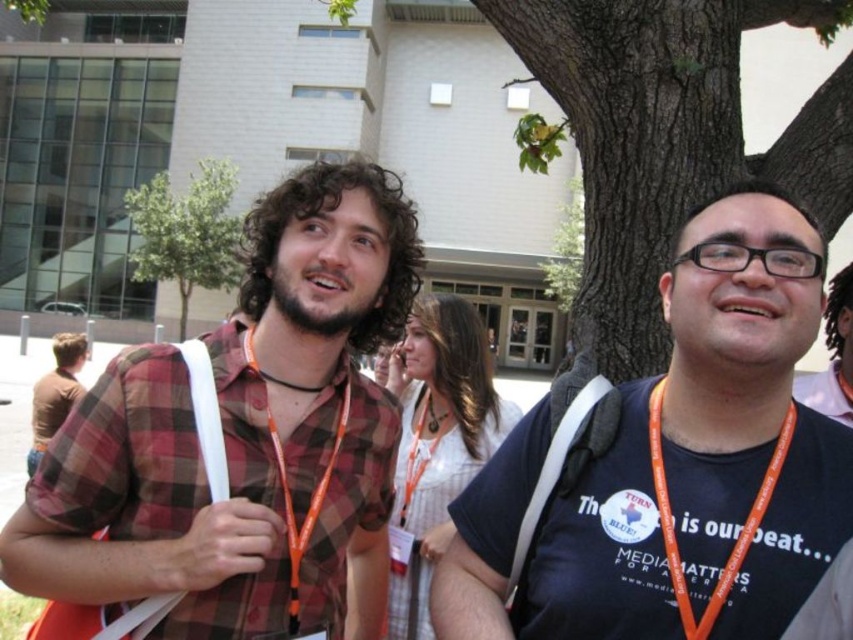
Please look at the image and locate the orange lanyard at center. Is there a point at coordinates (727, 392) on it?

Yes, the point at coordinates (727, 392) is located on the orange lanyard at center.

You are standing in the outdoor scene and want to locate the orange lanyard at center. Based on the coordinates provided, can you determine its position relative to the other objects in the scene?

The orange lanyard at center is located at coordinates point (727, 392), which places it in the lower right portion of the image.

From the picture: You are standing in front of the large modern building and see the green leafy tree at upper left and the black cord at center. Which object is located to the left of the other?

The green leafy tree at upper left is positioned on the left side of black cord at center.